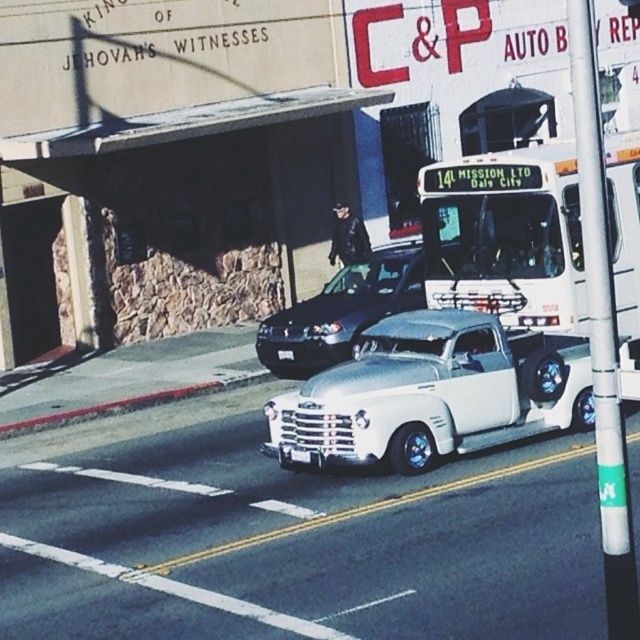
You are a pedestrian standing at the crosswalk and see the white metallic truck at center and the white matte bus at upper center. Which one is closer to the crosswalk?

The white metallic truck at center is closer to the crosswalk because it is positioned below the white matte bus at upper center, indicating it is lower in the frame and thus nearer to the pedestrian at the crosswalk.

You are a pedestrian standing on the sidewalk and want to cross the street to reach the other side. There is a white metallic truck at center and a shiny black sedan at center in the road. Considering their distance apart, do you think there is enough space between them to safely cross?

The white metallic truck at center and the shiny black sedan at center are 15.44 feet apart from each other. This distance provides sufficient space to safely cross between them, so yes, it is possible to cross safely.

You are a delivery driver who needs to park your vehicle under a low clearance bridge. The bridge has a height restriction of 3 meters. You observe the white metallic truck at center and the white matte bus at upper center in the scene. Which vehicle would you choose to park under the bridge to ensure it fits safely?

The white metallic truck at center is not as tall as the white matte bus at upper center, so the white metallic truck at center would be the safer choice to park under the bridge since it has a lower height.